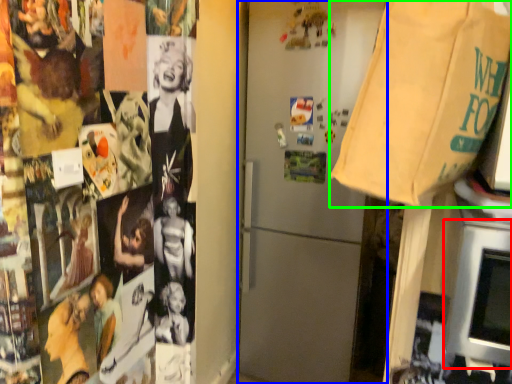
Question: Considering the real-world distances, which object is farthest from oven (highlighted by a red box)? refrigerator (highlighted by a blue box) or grocery bag (highlighted by a green box)?

Choices:
 (A) refrigerator
 (B) grocery bag

Answer: (A)